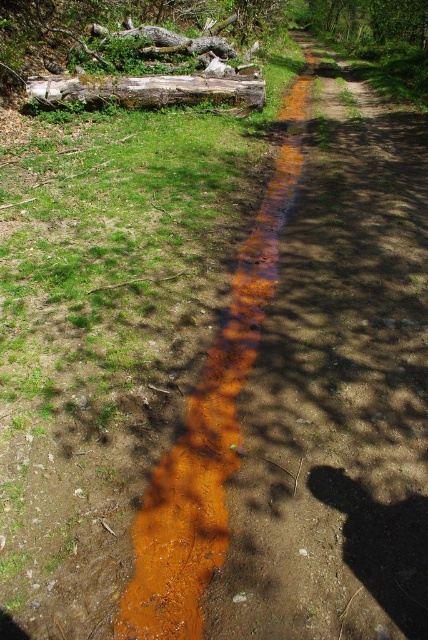
You are a hiker who has stumbled upon this path. You notice the brown mud at center and the weathered wood log at upper left. Which object would you estimate to be bigger in size?

The brown mud at center is larger in size than the weathered wood log at upper left, so the brown mud at center would be the bigger object.

Consider the image. You are a hiker who has spotted the brown mud at center and the weathered wood log at upper left along the path. Which object is closer to your current position as you walk along the path?

The brown mud at center is closer to your current position because it is in front of the weathered wood log at upper left, indicating that the log is further ahead along the path.

You are a hiker carrying a map with coordinates. You need to avoid the brown mud at center. According to the coordinates provided, where should you walk instead?

The brown mud at center is located at point (210,428). To avoid it, you should walk on the grassy areas on both sides of the path, which are not contaminated and are located away from the center coordinates.